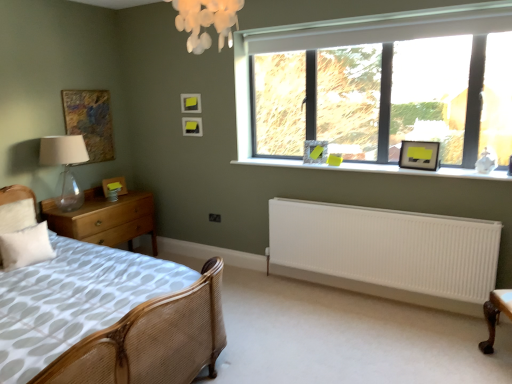
What is the approximate height of wooden chest of drawers at left?

The height of wooden chest of drawers at left is 27.87 inches.

What do you see at coordinates (192, 126) in the screenshot? I see `matte black picture frame at upper center, the third picture frame positioned from the right` at bounding box center [192, 126].

Measure the distance between point (x=122, y=182) and camera.

4.56 meters.

What is the approximate width of white smooth window sill at center?

It is 13.23 inches.

How much space does matte black picture frame at upper center, which is the third picture frame from left to right, occupy horizontally?

matte black picture frame at upper center, which is the third picture frame from left to right, is 1.60 inches wide.

The height and width of the screenshot is (384, 512). What are the coordinates of `matte black picture frame at upper center, which ranks as the 4th picture frame in right-to-left order` in the screenshot? It's located at (190, 103).

The image size is (512, 384). In order to click on wooden chest of drawers at left in this screenshot , I will do `click(105, 219)`.

Choose the correct answer: Is matte yellow picture frame at left, positioned as the 5th picture frame in right-to-left order, inside wooden chest of drawers at left or outside it?

matte yellow picture frame at left, positioned as the 5th picture frame in right-to-left order, is located beyond the bounds of wooden chest of drawers at left.

From a real-world perspective, which is physically below, matte yellow picture frame at left, positioned as the 5th picture frame in right-to-left order, or wooden chest of drawers at left?

From a 3D spatial view, wooden chest of drawers at left is below.

Is matte yellow picture frame at left, positioned as the 5th picture frame in right-to-left order, in front of or behind wooden chest of drawers at left in the image?

Clearly, matte yellow picture frame at left, positioned as the 5th picture frame in right-to-left order, is behind wooden chest of drawers at left.

From the image's perspective, which is above, matte yellow picture frame at left, which ranks as the 2th picture frame in left-to-right order, or wooden chest of drawers at left?

matte yellow picture frame at left, which ranks as the 2th picture frame in left-to-right order.

Consider the image. From a real-world perspective, between matte black picture frame at upper right, positioned as the first picture frame in right-to-left order, and woven cane bed at lower left, who is vertically lower?

→ woven cane bed at lower left.

Looking at this image, is matte black picture frame at upper right, positioned as the first picture frame in right-to-left order, at the right side of woven cane bed at lower left?

Yes.

Is matte black picture frame at upper right, the sixth picture frame when ordered from left to right, positioned with its back to woven cane bed at lower left?

No, matte black picture frame at upper right, the sixth picture frame when ordered from left to right,'s orientation is not away from woven cane bed at lower left.

Between matte black picture frame at upper right, the sixth picture frame when ordered from left to right, and woven cane bed at lower left, which one has less height?

With less height is matte black picture frame at upper right, the sixth picture frame when ordered from left to right.

Looking at the image, does matte wooden picture frame at upper left, the 1th picture frame when ordered from left to right, seem bigger or smaller compared to transparent glass table lamp at left?

Considering their sizes, matte wooden picture frame at upper left, the 1th picture frame when ordered from left to right, takes up less space than transparent glass table lamp at left.

From the picture: Does matte wooden picture frame at upper left, the 1th picture frame when ordered from left to right, appear on the right side of transparent glass table lamp at left?

Correct, you'll find matte wooden picture frame at upper left, the 1th picture frame when ordered from left to right, to the right of transparent glass table lamp at left.

This screenshot has height=384, width=512. Identify the location of picture frame that is the 4th object above the transparent glass table lamp at left (from a real-world perspective). (90, 121).

Is matte wooden picture frame at upper left, the sixth picture frame positioned from the right, directly adjacent to transparent glass table lamp at left?

No, matte wooden picture frame at upper left, the sixth picture frame positioned from the right, is not making contact with transparent glass table lamp at left.

Which object is further away from the camera taking this photo, transparent glass table lamp at left or matte yellow picture frame at left, which ranks as the 2th picture frame in left-to-right order?

matte yellow picture frame at left, which ranks as the 2th picture frame in left-to-right order, is behind.

Could you tell me if transparent glass table lamp at left is facing matte yellow picture frame at left, which ranks as the 2th picture frame in left-to-right order?

A: No, transparent glass table lamp at left is not facing towards matte yellow picture frame at left, which ranks as the 2th picture frame in left-to-right order.

Would you say transparent glass table lamp at left is a long distance from matte yellow picture frame at left, positioned as the 5th picture frame in right-to-left order?

No, transparent glass table lamp at left is not far from matte yellow picture frame at left, positioned as the 5th picture frame in right-to-left order.

From a real-world perspective, is matte black picture frame at upper right, positioned as the first picture frame in right-to-left order, above or below clear glass window at upper right?

matte black picture frame at upper right, positioned as the first picture frame in right-to-left order, is below clear glass window at upper right.

Is matte black picture frame at upper right, the sixth picture frame when ordered from left to right, positioned with its back to clear glass window at upper right?

Yes, matte black picture frame at upper right, the sixth picture frame when ordered from left to right,'s orientation is away from clear glass window at upper right.

Is matte black picture frame at upper right, positioned as the first picture frame in right-to-left order, further to the viewer compared to clear glass window at upper right?

Yes, matte black picture frame at upper right, positioned as the first picture frame in right-to-left order, is further from the viewer.

Between matte black picture frame at upper right, the sixth picture frame when ordered from left to right, and clear glass window at upper right, which one appears on the left side from the viewer's perspective?

From the viewer's perspective, clear glass window at upper right appears more on the left side.

Considering the sizes of objects matte black picture frame at upper right, the 5th picture frame when ordered from left to right, and transparent glass table lamp at left in the image provided, who is shorter, matte black picture frame at upper right, the 5th picture frame when ordered from left to right, or transparent glass table lamp at left?

Standing shorter between the two is matte black picture frame at upper right, the 5th picture frame when ordered from left to right.

Which is correct: matte black picture frame at upper right, the 5th picture frame when ordered from left to right, is inside transparent glass table lamp at left, or outside of it?

matte black picture frame at upper right, the 5th picture frame when ordered from left to right, is located beyond the bounds of transparent glass table lamp at left.

From the image's perspective, between matte black picture frame at upper right, placed as the second picture frame when sorted from right to left, and transparent glass table lamp at left, which one is located above?

matte black picture frame at upper right, placed as the second picture frame when sorted from right to left, appears higher in the image.

From a real-world perspective, is matte black picture frame at upper right, the 5th picture frame when ordered from left to right, physically above clear glass window at upper right?

No, from a real-world perspective, matte black picture frame at upper right, the 5th picture frame when ordered from left to right, is not on top of clear glass window at upper right.

Considering the sizes of objects matte black picture frame at upper right, the 5th picture frame when ordered from left to right, and clear glass window at upper right in the image provided, who is taller, matte black picture frame at upper right, the 5th picture frame when ordered from left to right, or clear glass window at upper right?

With more height is clear glass window at upper right.

Is matte black picture frame at upper right, placed as the second picture frame when sorted from right to left, further to the viewer compared to clear glass window at upper right?

Yes, it is.

This screenshot has height=384, width=512. I want to click on picture frame that is the 1st object located above the wooden chest of drawers at left (from the image's perspective), so click(114, 186).

This screenshot has height=384, width=512. I want to click on bed that is in front of the matte black picture frame at upper right, positioned as the first picture frame in right-to-left order, so click(111, 319).

Which object lies nearer to the anchor point white ribbed radiator at lower center, matte black picture frame at upper center, the third picture frame positioned from the right, or matte yellow picture frame at left, which ranks as the 2th picture frame in left-to-right order?

matte black picture frame at upper center, the third picture frame positioned from the right.

Based on their spatial positions, is matte black picture frame at upper right, the sixth picture frame when ordered from left to right, or clear glass window at upper right closer to white soft pillow at lower left?

clear glass window at upper right lies closer to white soft pillow at lower left than the other object.

Which object lies nearer to the anchor point matte black picture frame at upper center, which ranks as the 4th picture frame in right-to-left order, white soft pillow at lower left or white ribbed radiator at lower center?

white soft pillow at lower left lies closer to matte black picture frame at upper center, which ranks as the 4th picture frame in right-to-left order, than the other object.

In the scene shown: Considering their positions, is white ribbed radiator at lower center positioned closer to white smooth window sill at center than matte yellow picture frame at left, positioned as the 5th picture frame in right-to-left order?

white ribbed radiator at lower center is positioned closer to the anchor white smooth window sill at center.

Which object lies nearer to the anchor point matte black picture frame at upper center, the third picture frame positioned from the right, transparent glass table lamp at left or clear glass window at upper right?

The object closer to matte black picture frame at upper center, the third picture frame positioned from the right, is transparent glass table lamp at left.

Estimate the real-world distances between objects in this image. Which object is further from matte black picture frame at upper center, acting as the fourth picture frame starting from the left, white smooth window sill at center or woven cane bed at lower left?

woven cane bed at lower left is positioned further to the anchor matte black picture frame at upper center, acting as the fourth picture frame starting from the left.

Looking at the image, which one is located further to matte black picture frame at upper right, positioned as the first picture frame in right-to-left order, white ribbed radiator at lower center or matte black picture frame at upper center, which ranks as the 4th picture frame in right-to-left order?

matte black picture frame at upper center, which ranks as the 4th picture frame in right-to-left order, is positioned further to the anchor matte black picture frame at upper right, positioned as the first picture frame in right-to-left order.

Which object lies nearer to the anchor point matte black picture frame at upper right, positioned as the first picture frame in right-to-left order, matte black picture frame at upper right, placed as the second picture frame when sorted from right to left, or woven cane bed at lower left?

Based on the image, woven cane bed at lower left appears to be nearer to matte black picture frame at upper right, positioned as the first picture frame in right-to-left order.

Locate an element on the screen. window sill situated between woven cane bed at lower left and white ribbed radiator at lower center from left to right is located at coordinates (376, 169).

Where is `picture frame positioned between white smooth window sill at center and matte black picture frame at upper right, the 5th picture frame when ordered from left to right, from near to far`? Image resolution: width=512 pixels, height=384 pixels. picture frame positioned between white smooth window sill at center and matte black picture frame at upper right, the 5th picture frame when ordered from left to right, from near to far is located at coordinates (419, 155).

This screenshot has width=512, height=384. In order to click on radiator situated between woven cane bed at lower left and clear glass window at upper right from left to right in this screenshot , I will do `click(386, 252)`.

Where is `chest of drawers between white soft pillow at lower left and white smooth window sill at center from left to right`? This screenshot has width=512, height=384. chest of drawers between white soft pillow at lower left and white smooth window sill at center from left to right is located at coordinates (105, 219).